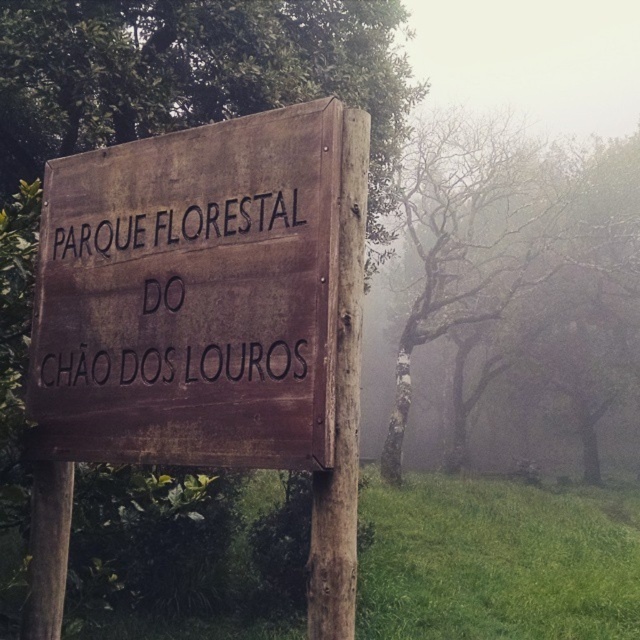
Consider the image. Can you confirm if green matte signpost at center is shorter than bare branches at center?

Correct, green matte signpost at center is not as tall as bare branches at center.

Can you confirm if green matte signpost at center is wider than bare branches at center?

No, green matte signpost at center is not wider than bare branches at center.

At what (x,y) coordinates should I click in order to perform the action: click on green matte signpost at center. Please return your answer as a coordinate pair (x, y). The width and height of the screenshot is (640, 640). Looking at the image, I should click on pyautogui.click(x=193, y=72).

Can you confirm if brown wooden sign at center is thinner than green matte signpost at center?

Yes.

Does brown wooden sign at center come behind green matte signpost at center?

No, it is not.

Locate an element on the screen. The image size is (640, 640). brown wooden sign at center is located at coordinates (192, 296).

You are a GUI agent. You are given a task and a screenshot of the screen. Output one action in this format:
    pyautogui.click(x=<x>, y=<y>)
    Task: Click on the brown wooden sign at center
    This screenshot has height=640, width=640.
    Given the screenshot: What is the action you would take?
    pyautogui.click(x=192, y=296)

Between brown wooden sign at center and bare branches at center, which one is positioned higher?

bare branches at center

Who is more distant from viewer, (x=198, y=179) or (x=472, y=218)?

The point (x=472, y=218) is behind.

The image size is (640, 640). Describe the element at coordinates (192, 296) in the screenshot. I see `brown wooden sign at center` at that location.

This screenshot has height=640, width=640. In order to click on brown wooden sign at center in this screenshot , I will do `click(192, 296)`.